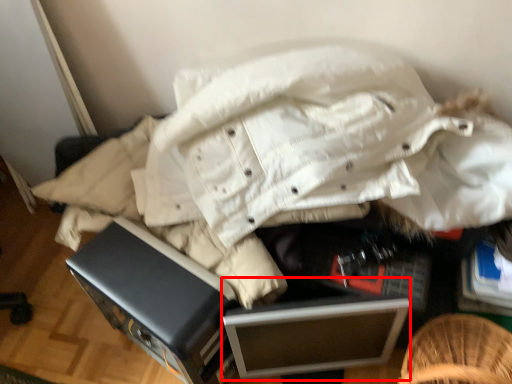
Question: From the image's perspective, where is file cabinet (annotated by the red box) located relative to furniture?

Choices:
 (A) below
 (B) above

Answer: (A)